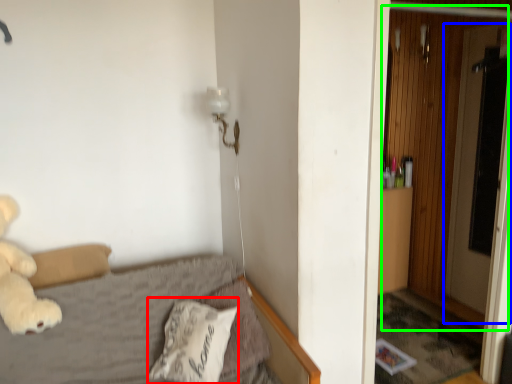
Question: Estimate the real-world distances between objects in this image. Which object is closer to pillow (highlighted by a red box), screen door (highlighted by a blue box) or door (highlighted by a green box)?

Choices:
 (A) screen door
 (B) door

Answer: (B)